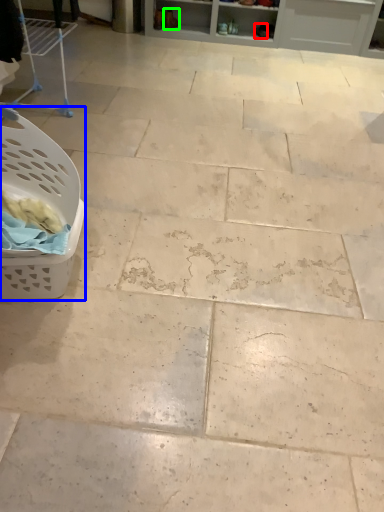
Question: Estimate the real-world distances between objects in this image. Which object is closer to footwear (highlighted by a red box), basket (highlighted by a blue box) or footwear (highlighted by a green box)?

Choices:
 (A) basket
 (B) footwear

Answer: (B)